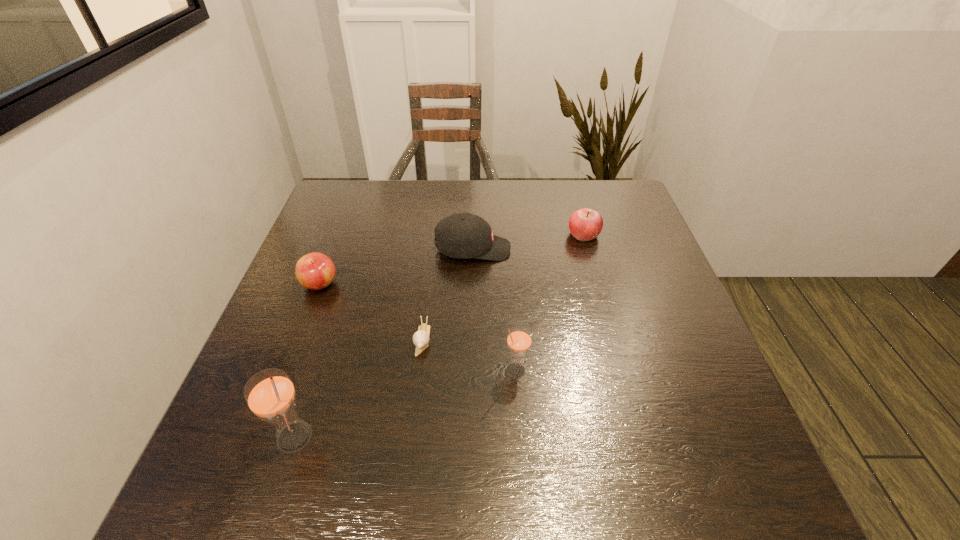
Locate an element on the screen. Image resolution: width=960 pixels, height=540 pixels. vacant space that is in between the right apple and the shortest object is located at coordinates (503, 287).

Where is `vacant space in between the fourth nearest object and the tallest object`? The height and width of the screenshot is (540, 960). vacant space in between the fourth nearest object and the tallest object is located at coordinates (307, 360).

What are the coordinates of `empty space that is in between the right apple and the second nearest object` in the screenshot? It's located at (550, 302).

The width and height of the screenshot is (960, 540). Identify the location of free spot between the right straw and the third nearest object. (469, 354).

Find the location of `empty space that is in between the nearer apple and the nearer straw`. empty space that is in between the nearer apple and the nearer straw is located at coordinates (307, 360).

Locate an element on the screen. This screenshot has width=960, height=540. free area in between the fourth nearest object and the fourth shortest object is located at coordinates (396, 267).

Where is `vacant space that's between the nearer straw and the fifth shortest object`? The image size is (960, 540). vacant space that's between the nearer straw and the fifth shortest object is located at coordinates (406, 403).

The height and width of the screenshot is (540, 960). Find the location of `vacant area that lies between the nearer straw and the third farthest object`. vacant area that lies between the nearer straw and the third farthest object is located at coordinates (307, 360).

This screenshot has height=540, width=960. Find the location of `free space between the farther apple and the baseball cap`. free space between the farther apple and the baseball cap is located at coordinates (528, 242).

Locate which object ranks third in proximity to the farther apple. Please provide its 2D coordinates. Your answer should be formatted as a tuple, i.e. [(x, y)], where the tuple contains the x and y coordinates of a point satisfying the conditions above.

[(421, 337)]